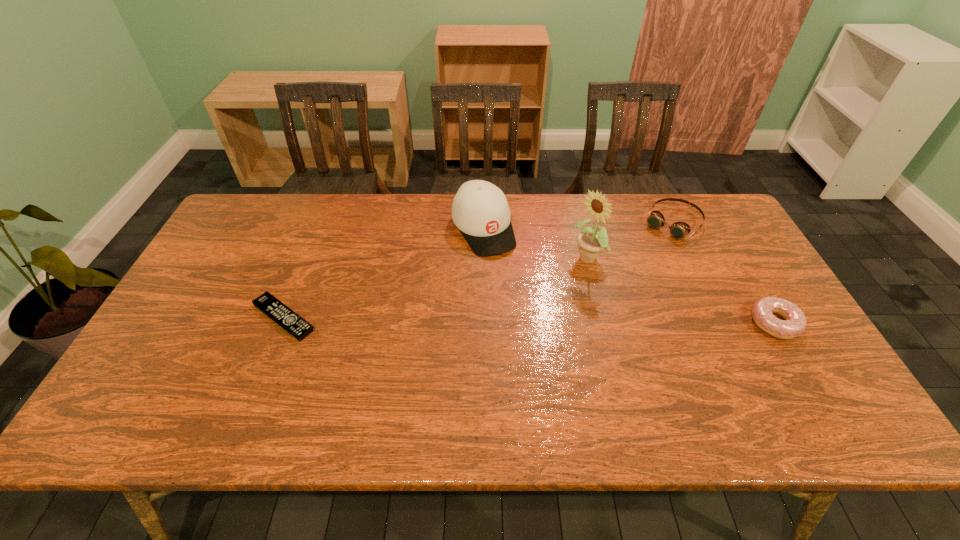
At what (x,y) coordinates should I click in order to perform the action: click on goggles that is at the far edge. Please return your answer as a coordinate pair (x, y). Looking at the image, I should click on (678, 230).

I want to click on doughnut situated at the right edge, so click(x=794, y=323).

Locate an element on the screen. Image resolution: width=960 pixels, height=540 pixels. goggles located in the right edge section of the desktop is located at coordinates (678, 230).

This screenshot has width=960, height=540. I want to click on object present at the far right corner, so click(x=678, y=230).

Where is `vacant space at the far edge of the desktop`? The image size is (960, 540). vacant space at the far edge of the desktop is located at coordinates (658, 203).

Where is `vacant space at the near edge of the desktop`? This screenshot has height=540, width=960. vacant space at the near edge of the desktop is located at coordinates (732, 379).

Identify the location of vacant area at the left edge. The width and height of the screenshot is (960, 540). (156, 352).

Find the location of a particular element. vacant space at the right edge of the desktop is located at coordinates (745, 338).

In the image, there is a desktop. Identify the location of vacant space at the far left corner. This screenshot has height=540, width=960. (232, 221).

What are the coordinates of `vacant area that lies between the remote control and the goggles` in the screenshot? It's located at (478, 270).